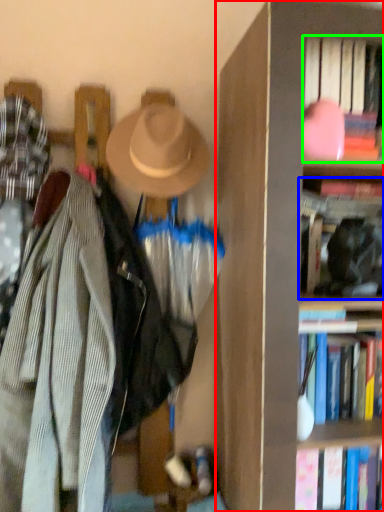
Question: Estimate the real-world distances between objects in this image. Which object is farther from bookcase (highlighted by a red box), book (highlighted by a blue box) or book (highlighted by a green box)?

Choices:
 (A) book
 (B) book

Answer: (A)